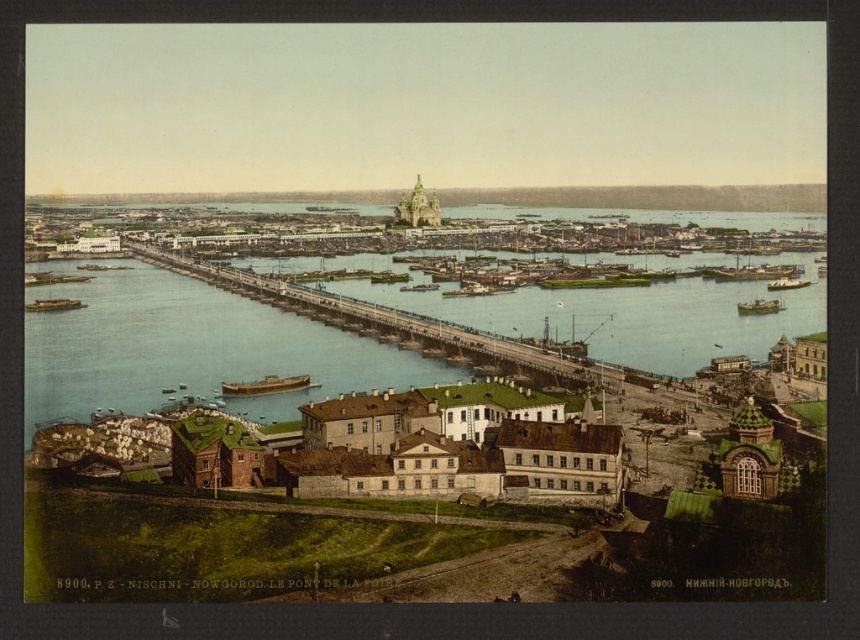
You are standing on the left bank of the city and want to cross the river to the right bank. You see the blue water at center and the green matte boat at right. Which direction should you head towards to reach the boat?

You should head towards the right because the green matte boat at right is positioned to the right of the blue water at center.

You are a city planner reviewing this historical image. You need to determine if the green matte boat at right can pass under the metallic gray bridge at center. Based on the scene description, can the boat fit under the bridge?

The metallic gray bridge at center is wider than the green matte boat at right, so the boat should be able to pass under the bridge as long as its dimensions other than width are compatible with the bridge structure.